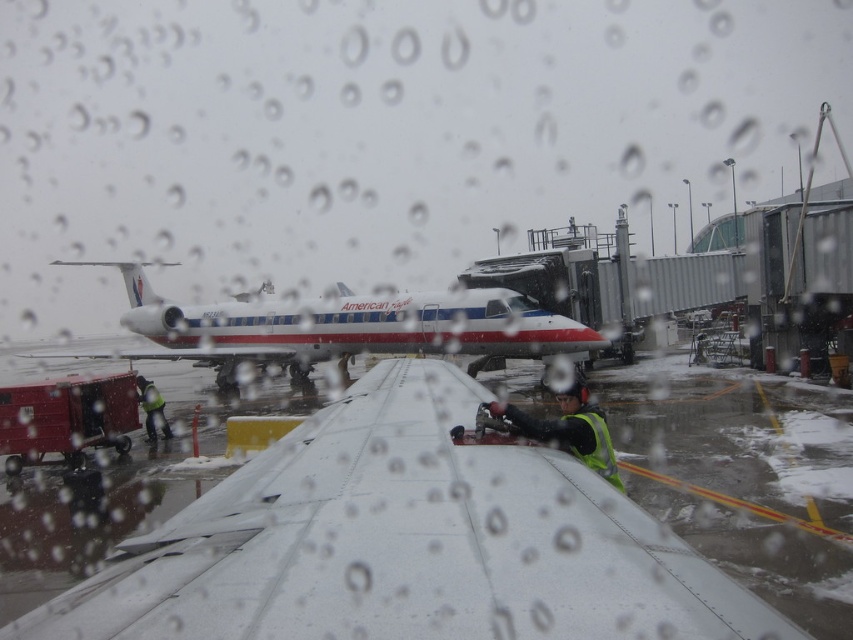
Image resolution: width=853 pixels, height=640 pixels. I want to click on white glossy airplane at center, so click(344, 326).

Is point (549, 349) behind point (579, 394)?

That is True.

Does point (190, 339) lie in front of point (572, 380)?

That is False.

You are a GUI agent. You are given a task and a screenshot of the screen. Output one action in this format:
    pyautogui.click(x=<x>, y=<y>)
    Task: Click on the white glossy airplane at center
    The width and height of the screenshot is (853, 640).
    Given the screenshot: What is the action you would take?
    pyautogui.click(x=344, y=326)

Can you confirm if white matte airport runway at center is smaller than yellow reflective vest at center?

No, white matte airport runway at center is not smaller than yellow reflective vest at center.

Is white matte airport runway at center to the right of yellow reflective vest at center from the viewer's perspective?

Correct, you'll find white matte airport runway at center to the right of yellow reflective vest at center.

Which is behind, point (132, 525) or point (505, 412)?

The point (132, 525) is more distant.

What are the coordinates of `white matte airport runway at center` in the screenshot? It's located at (408, 529).

Can you confirm if yellow reflective vest at center is positioned below reflective yellow safety vest at lower left?

No.

Who is more forward, (566, 403) or (158, 397)?

Positioned in front is point (566, 403).

Where is `yellow reflective vest at center`? The image size is (853, 640). yellow reflective vest at center is located at coordinates (567, 428).